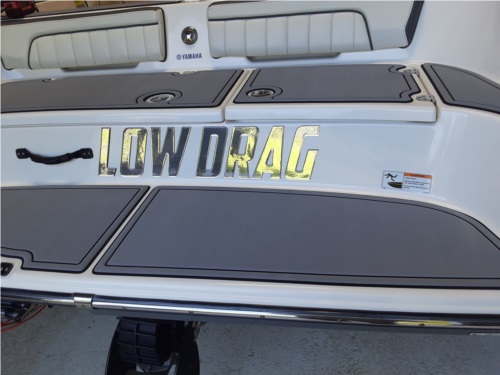
Where is `doors`? doors is located at coordinates (172, 114), (286, 111).